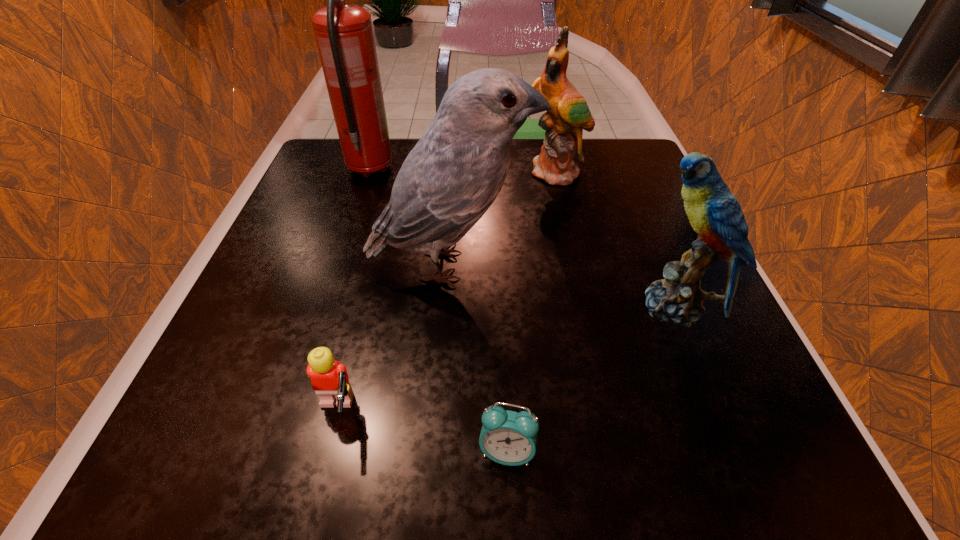
In order to click on vacant space situated on the front-facing side of the second parrot from right to left in this screenshot , I will do click(x=571, y=234).

Locate an element on the screen. vacant space located on the face of the shortest parrot is located at coordinates (406, 306).

Identify the location of vacant region located on the face of the shortest parrot. (520, 306).

Image resolution: width=960 pixels, height=540 pixels. What are the coordinates of `free location located 0.190m on the face of the shortest parrot` in the screenshot? It's located at (520, 306).

You are a GUI agent. You are given a task and a screenshot of the screen. Output one action in this format:
    pyautogui.click(x=<x>, y=<y>)
    Task: Click on the free space located in front of the Lego with the accessory visible
    The image size is (960, 540).
    Given the screenshot: What is the action you would take?
    pyautogui.click(x=427, y=413)

Where is `fire extinguisher that is at the far edge`? The image size is (960, 540). fire extinguisher that is at the far edge is located at coordinates (344, 34).

Identify the location of parrot situated at the far edge. (562, 148).

Identify the location of Lego situated at the near edge. (329, 378).

Where is `alarm clock present at the near edge`? The image size is (960, 540). alarm clock present at the near edge is located at coordinates (507, 437).

Find the location of `object that is at the left edge`. object that is at the left edge is located at coordinates (344, 34).